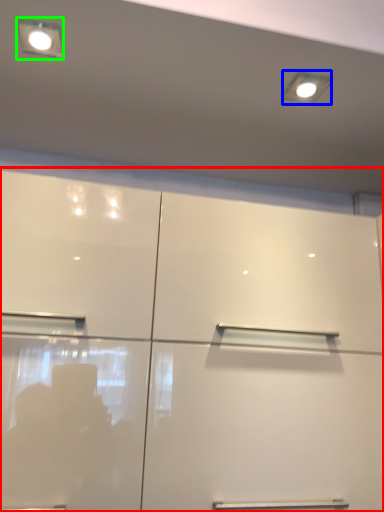
Question: Estimate the real-world distances between objects in this image. Which object is farther from cupboard (highlighted by a red box), lighting (highlighted by a blue box) or light fixture (highlighted by a green box)?

Choices:
 (A) lighting
 (B) light fixture

Answer: (B)